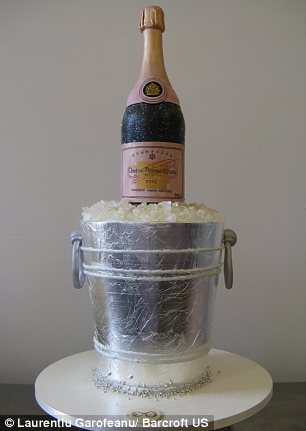
Find the location of a particular element. Image resolution: width=306 pixels, height=431 pixels. handle is located at coordinates pos(77,269).